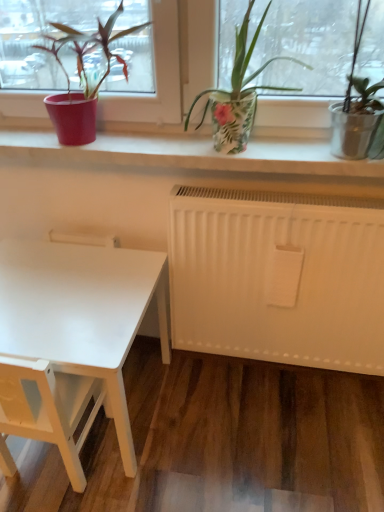
Question: In the image, is white matte table at lower left positioned in front of or behind matte red pot at left, which is counted as the second houseplant, starting from the right?

Choices:
 (A) front
 (B) behind

Answer: (B)

Question: Is white matte table at lower left wider or thinner than matte red pot at left, which is counted as the second houseplant, starting from the right?

Choices:
 (A) thin
 (B) wide

Answer: (B)

Question: Which object is positioned closest to the floral-patterned pot at center, acting as the 2th houseplant starting from the left?

Choices:
 (A) white matte table at lower left
 (B) matte red pot at left, arranged as the 1th houseplant when viewed from the left
 (C) white matte table at lower left

Answer: (B)

Question: Which is nearer to the matte red pot at left, which is counted as the second houseplant, starting from the right?

Choices:
 (A) white matte table at lower left
 (B) white matte table at lower left
 (C) floral-patterned pot at center, acting as the 2th houseplant starting from the left

Answer: (C)